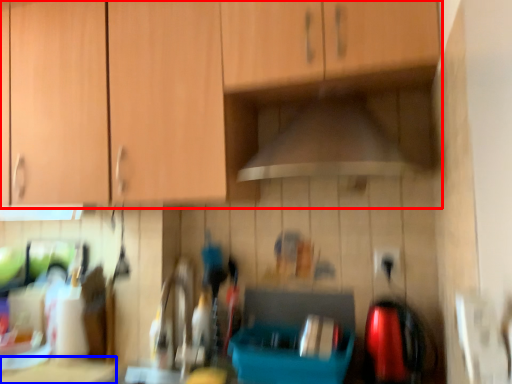
Question: Among these objects, which one is nearest to the camera, cabinetry (highlighted by a red box) or counter top (highlighted by a blue box)?

Choices:
 (A) cabinetry
 (B) counter top

Answer: (A)